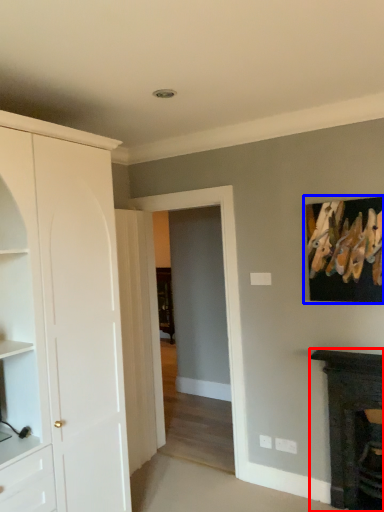
Question: Which of the following is the closest to the observer, fireplace (highlighted by a red box) or picture frame (highlighted by a blue box)?

Choices:
 (A) fireplace
 (B) picture frame

Answer: (A)